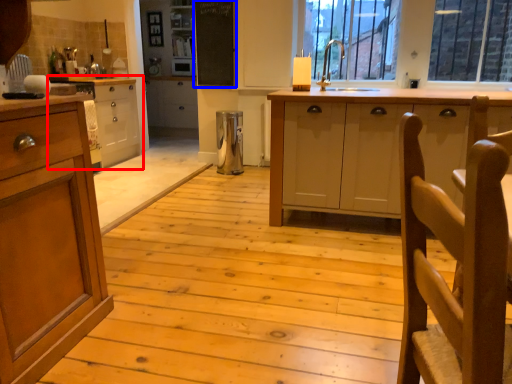
Question: Which object is further to the camera taking this photo, cabinetry (highlighted by a red box) or bulletin board (highlighted by a blue box)?

Choices:
 (A) cabinetry
 (B) bulletin board

Answer: (B)